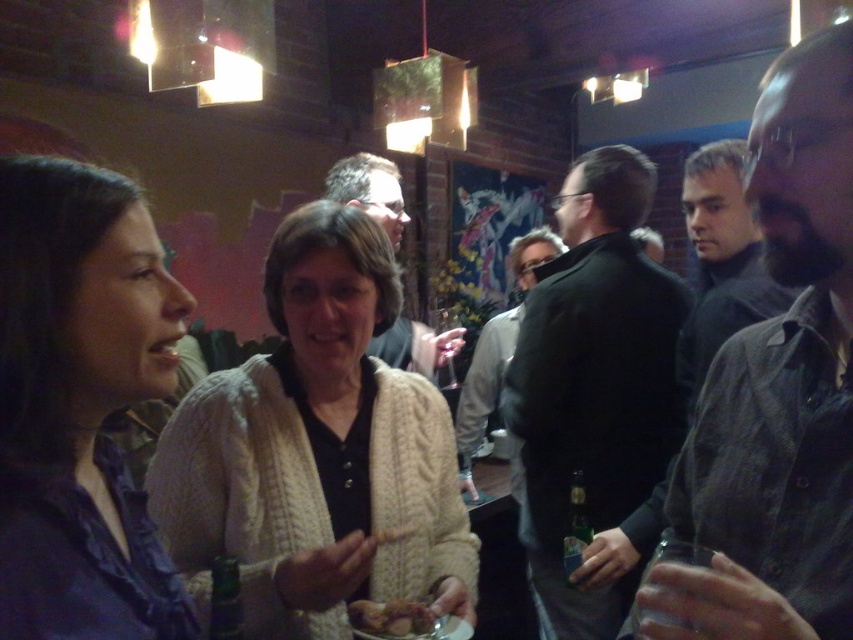
Question: Which object is closer to the camera taking this photo?

Choices:
 (A) clear plastic wine glass at center
 (B) brown crumbly bread at center
 (C) creamy knit sweater at center

Answer: (C)

Question: Is dark gray shirt at right positioned at the back of matte blue shirt at left?

Choices:
 (A) yes
 (B) no

Answer: (A)

Question: Is dark green glass bottle at lower right above clear plastic wine glass at center?

Choices:
 (A) no
 (B) yes

Answer: (A)

Question: Which of these objects is positioned farthest from the dark gray sweater at right?

Choices:
 (A) black matte jacket at center
 (B) matte black jacket at center

Answer: (B)

Question: Which point is farther to the camera?

Choices:
 (A) dark gray sweater at right
 (B) creamy knit sweater at center
 (C) black matte jacket at center

Answer: (C)

Question: Is dark gray sweater at right above clear plastic wine glass at center?

Choices:
 (A) no
 (B) yes

Answer: (B)